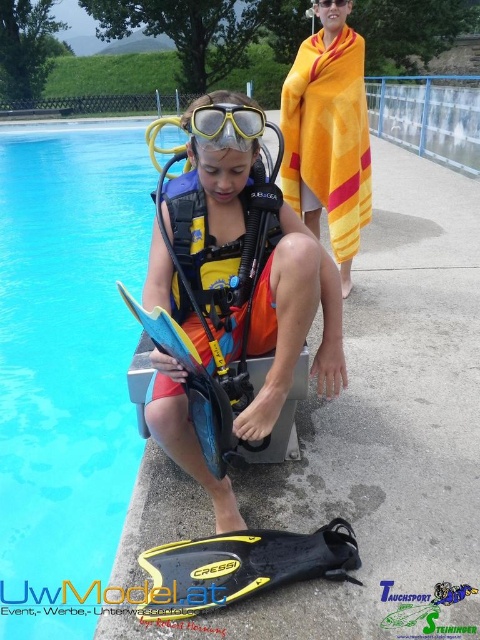
Question: Is yellow/orange fabric life jacket at center below yellow matte scuba mask at upper center?

Choices:
 (A) no
 (B) yes

Answer: (B)

Question: Estimate the real-world distances between objects in this image. Which object is closer to the yellow matte life vest at center?

Choices:
 (A) yellow/orange fabric life jacket at center
 (B) yellow towel at upper center

Answer: (A)

Question: Which of the following is the farthest from the observer?

Choices:
 (A) yellow matte life vest at center
 (B) yellow towel at upper center

Answer: (B)

Question: Is yellow/orange fabric life jacket at center positioned at the back of yellow matte scuba mask at upper center?

Choices:
 (A) yes
 (B) no

Answer: (A)

Question: Which point is farther to the camera?

Choices:
 (A) yellow towel at upper center
 (B) yellow matte life vest at center
 (C) yellow/orange fabric life jacket at center
 (D) yellow matte scuba mask at upper center

Answer: (A)

Question: Can you confirm if yellow matte life vest at center is wider than yellow/orange fabric life jacket at center?

Choices:
 (A) no
 (B) yes

Answer: (B)